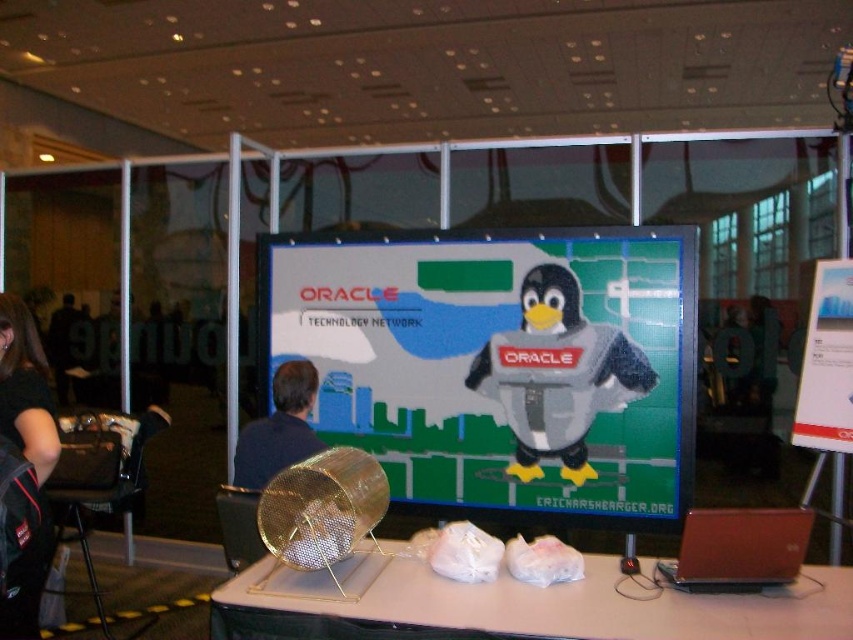
Question: Is white plastic table at center smaller than fuzzy fabric penguin at center?

Choices:
 (A) yes
 (B) no

Answer: (B)

Question: Does white plastic table at center lie behind fuzzy fabric penguin at center?

Choices:
 (A) no
 (B) yes

Answer: (A)

Question: Among these points, which one is nearest to the camera?

Choices:
 (A) (0, 360)
 (B) (663, 406)
 (C) (285, 369)
 (D) (529, 392)

Answer: (A)

Question: Among these points, which one is farthest from the camera?

Choices:
 (A) (625, 625)
 (B) (561, 422)
 (C) (582, 420)

Answer: (B)

Question: Does white plastic table at center have a lesser width compared to dark blue shirt at center?

Choices:
 (A) no
 (B) yes

Answer: (A)

Question: Among these points, which one is farthest from the camera?

Choices:
 (A) (312, 572)
 (B) (509, 358)
 (C) (546, 445)
 (D) (44, 573)

Answer: (B)